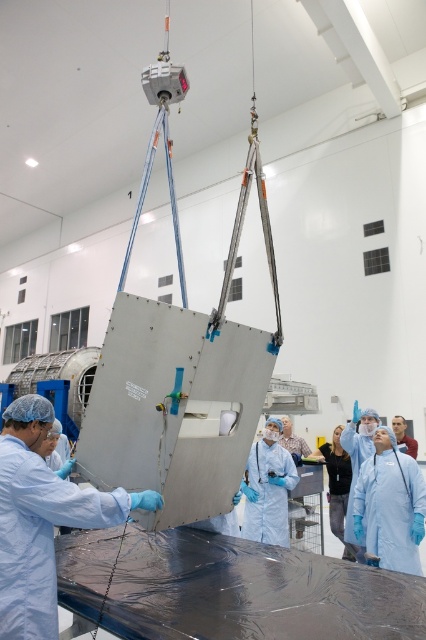
You are an engineer in the cleanroom and need to inspect two points on the metallic panel. The first point is at coordinates point (120,348) and the second is at point (39,502). Which point is closer to you when facing the panel?

Point (39,502) is closer to you because it is in front of point (120,348) according to their spatial arrangement.

You are an engineer standing in the cleanroom and need to inspect the gray matte panel at center. Can you reach it without moving closer than your current position?

The gray matte panel at center is 2.36 meters away from viewer. Since the average human arm length is about 0.7 meters, you cannot reach it without moving closer.

You are an engineer working in the cleanroom. You need to move the gray matte panel at center and the matte silver panel at center to different locations. Which panel should you move first if you want to move the one that is currently positioned to the right first?

The gray matte panel at center is to the right of the matte silver panel at center, so you should move the gray matte panel at center first since it is positioned to the right.